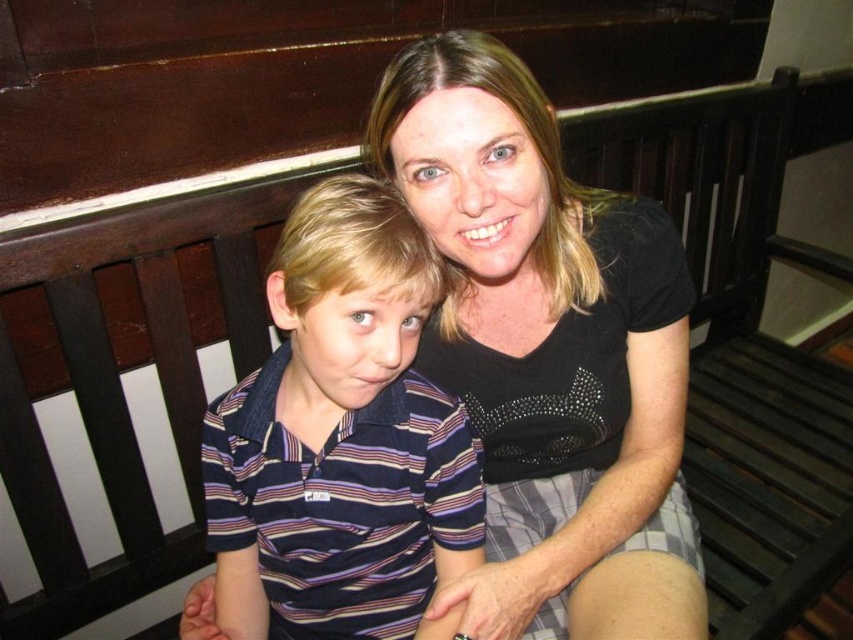
Is black matte shirt at upper center above striped cotton shirt at left?

Indeed, black matte shirt at upper center is positioned over striped cotton shirt at left.

Is black matte shirt at upper center further to camera compared to striped cotton shirt at left?

Yes, black matte shirt at upper center is further from the viewer.

Who is more forward, (543,273) or (393,385)?

Positioned in front is point (393,385).

The image size is (853, 640). Identify the location of black matte shirt at upper center. (548, 352).